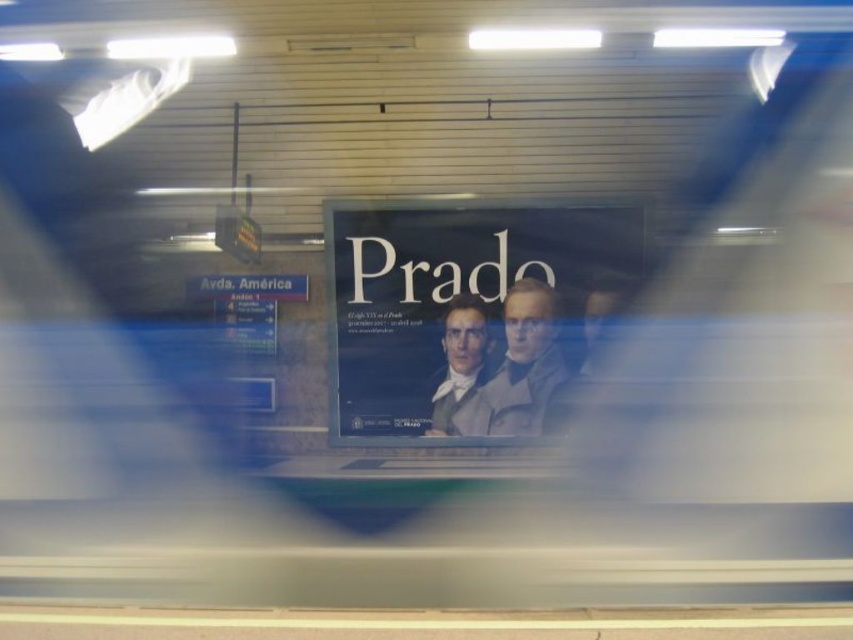
You are standing on the subway platform and want to take a photo of the smooth gray coat at center. Your camera is 8.29 meters away from the coat. Is the distance sufficient for a clear photo?

The smooth gray coat at center and camera are 8.29 meters apart, so the distance is sufficient for a clear photo.